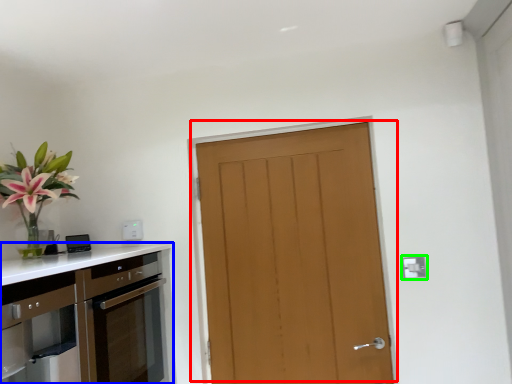
Question: Which is nearer to the door (highlighted by a red box)? cabinetry (highlighted by a blue box) or electric outlet (highlighted by a green box).

Choices:
 (A) cabinetry
 (B) electric outlet

Answer: (B)